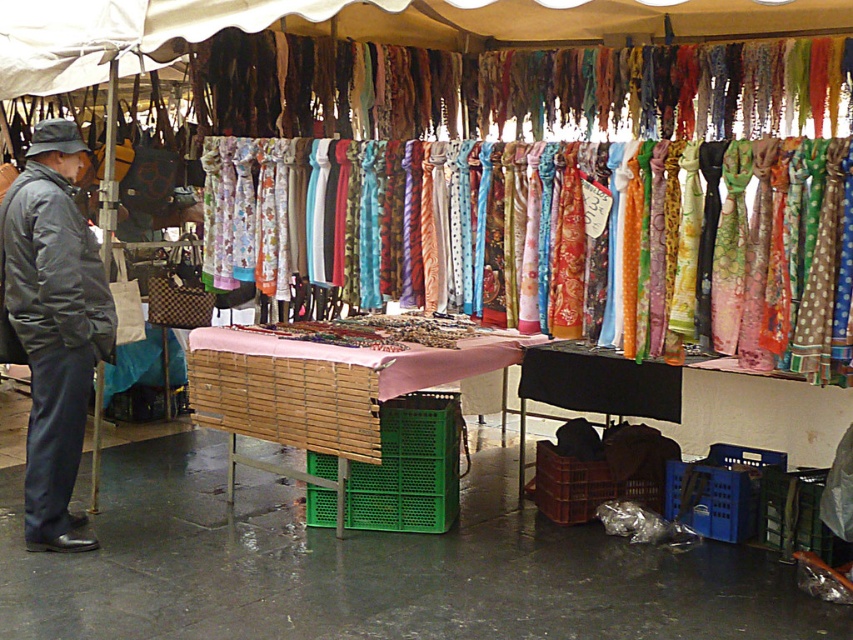
Question: Which object is the closest to the dark gray puffy jacket at left?

Choices:
 (A) floral silk scarf at center
 (B) wooden crate at center
 (C) dark gray fabric jacket at left

Answer: (C)

Question: Does wooden crate at center appear under dark gray puffy jacket at left?

Choices:
 (A) no
 (B) yes

Answer: (B)

Question: Does dark gray fabric jacket at left appear on the left side of wooden crate at center?

Choices:
 (A) yes
 (B) no

Answer: (A)

Question: Does dark gray fabric jacket at left lie behind floral silk scarf at center?

Choices:
 (A) no
 (B) yes

Answer: (B)

Question: Which object appears closest to the camera in this image?

Choices:
 (A) dark gray fabric jacket at left
 (B) dark gray puffy jacket at left

Answer: (B)

Question: Among these points, which one is farthest from the camera?

Choices:
 (A) (21, 296)
 (B) (32, 424)
 (C) (730, 214)

Answer: (B)